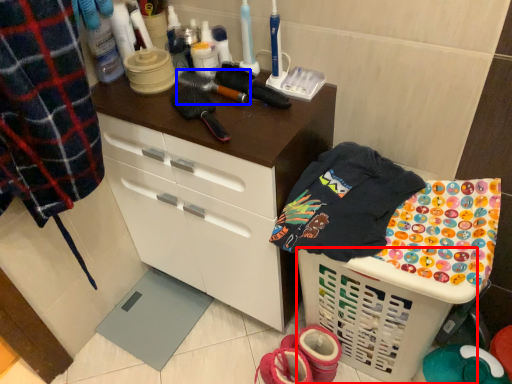
Question: Which object is closer to the camera taking this photo, basket (highlighted by a red box) or brush (highlighted by a blue box)?

Choices:
 (A) basket
 (B) brush

Answer: (A)